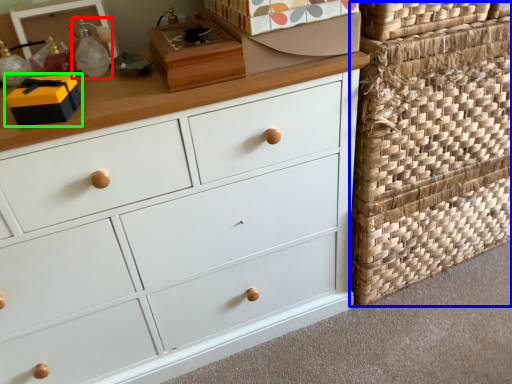
Question: Which is nearer to the toy (highlighted by a red box)? basket (highlighted by a blue box) or storage box (highlighted by a green box).

Choices:
 (A) basket
 (B) storage box

Answer: (B)